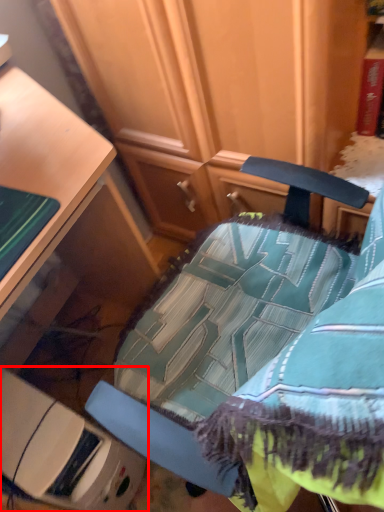
Question: From the image's perspective, what is the correct spatial positioning of furniture (annotated by the red box) in reference to chair?

Choices:
 (A) above
 (B) below

Answer: (B)